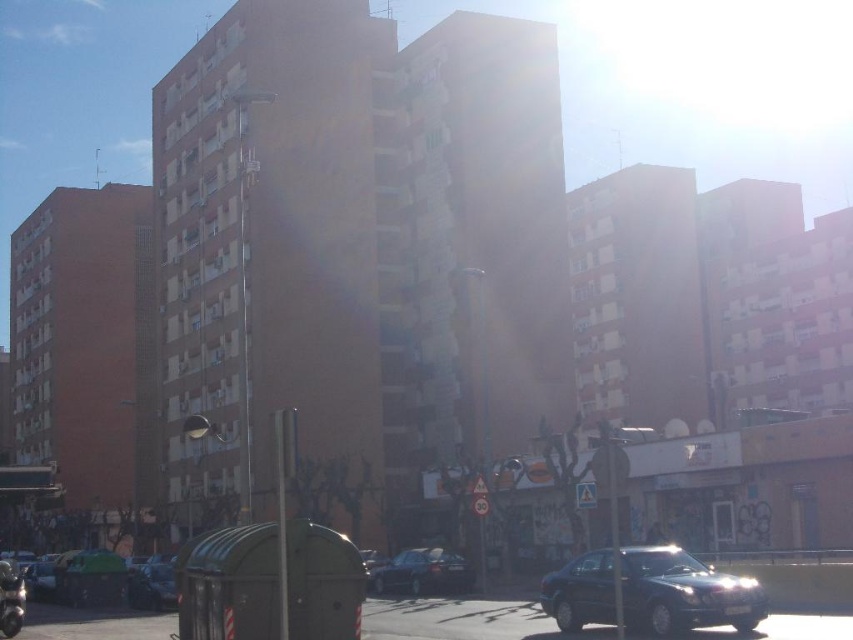
In order to click on shiny dark blue sedan at center in this screenshot , I will do `click(683, 593)`.

Can you confirm if shiny dark blue sedan at center is thinner than green matte car at lower left?

Correct, shiny dark blue sedan at center's width is less than green matte car at lower left's.

Is point (761, 612) positioned after point (163, 595)?

No, it is not.

This screenshot has height=640, width=853. What are the coordinates of `shiny dark blue sedan at center` in the screenshot? It's located at (683, 593).

Is green matte car at lower left thinner than shiny black sedan at center?

No.

This screenshot has width=853, height=640. What do you see at coordinates (108, 580) in the screenshot?
I see `green matte car at lower left` at bounding box center [108, 580].

Between point (140, 586) and point (438, 579), which one is positioned behind?

Point (438, 579)

You are a GUI agent. You are given a task and a screenshot of the screen. Output one action in this format:
    pyautogui.click(x=<x>, y=<y>)
    Task: Click on the green matte car at lower left
    This screenshot has width=853, height=640.
    Given the screenshot: What is the action you would take?
    pyautogui.click(x=108, y=580)

Between point (625, 563) and point (142, 604), which one is positioned in front?

Positioned in front is point (625, 563).

Does shiny dark blue sedan at center have a lesser width compared to shiny black car at lower left?

No.

Does point (572, 595) lie in front of point (152, 577)?

Yes.

Locate an element on the screen. shiny dark blue sedan at center is located at coordinates (683, 593).